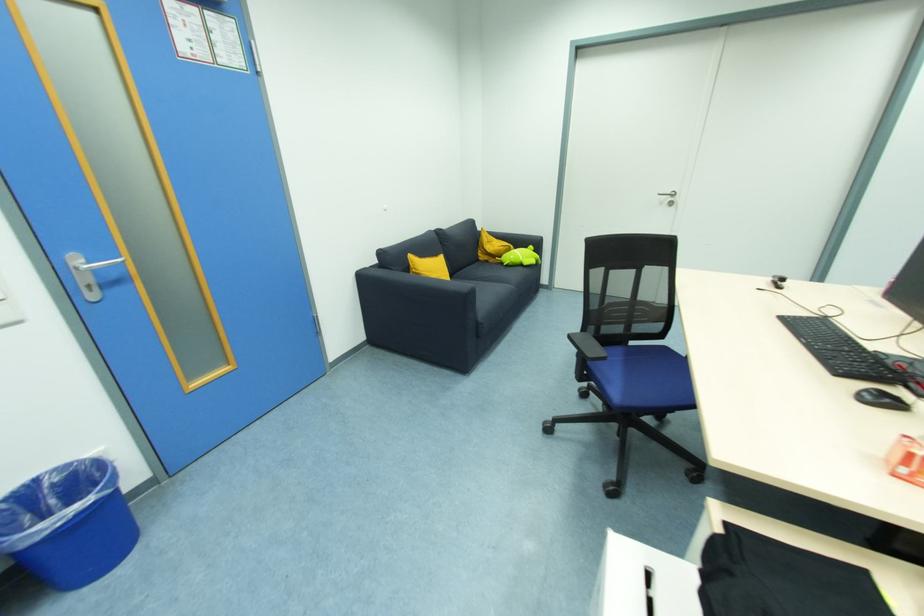
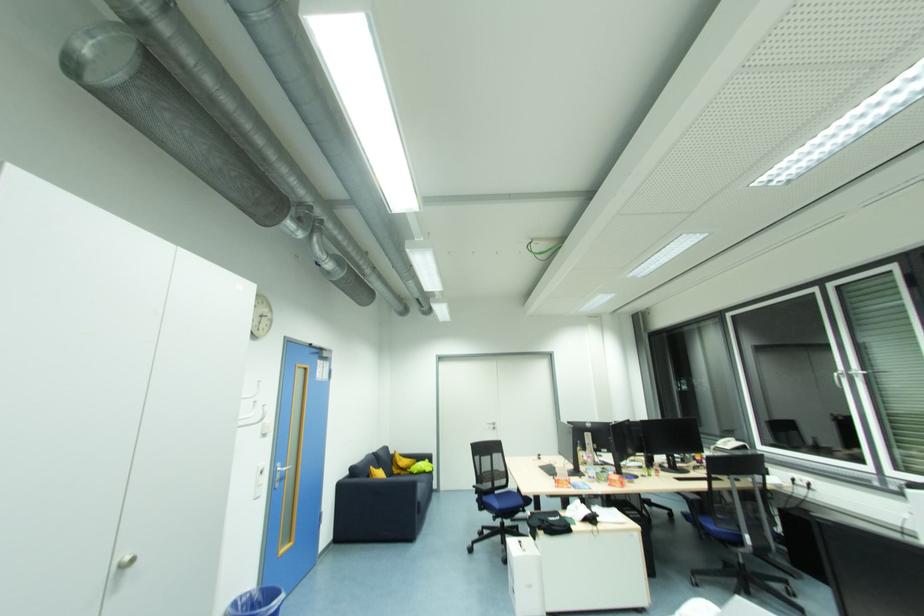
Locate, in the second image, the point that corresponds to (x=52, y=533) in the first image.

(280, 607)